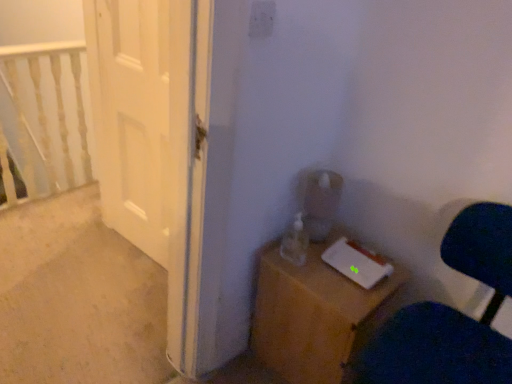
Find the location of a particular element. blank space situated above wooden nightstand at lower right (from a real-world perspective) is located at coordinates (x=335, y=259).